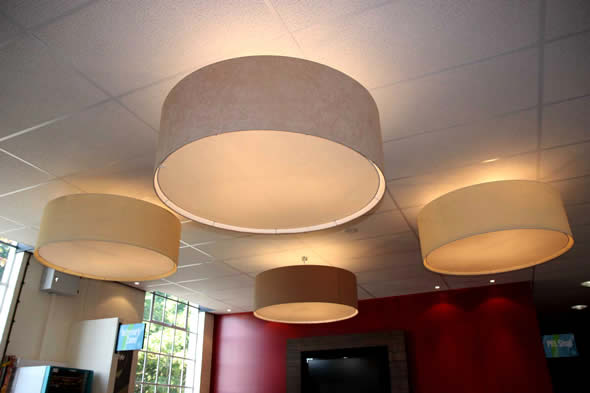
Locate an element on the screen. Image resolution: width=590 pixels, height=393 pixels. ceiling tile is located at coordinates (44, 103).